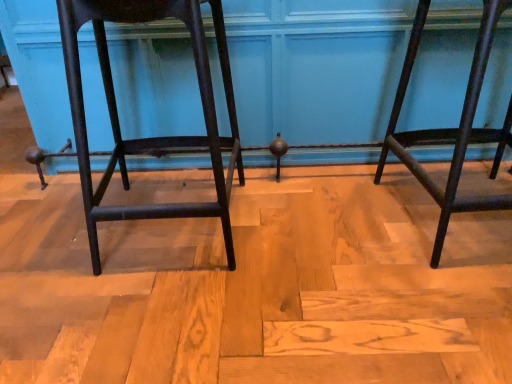
Image resolution: width=512 pixels, height=384 pixels. Find the location of `unoccupied region to the right of matte black stool at left, positioned as the 2th furniture in right-to-left order`. unoccupied region to the right of matte black stool at left, positioned as the 2th furniture in right-to-left order is located at coordinates (312, 228).